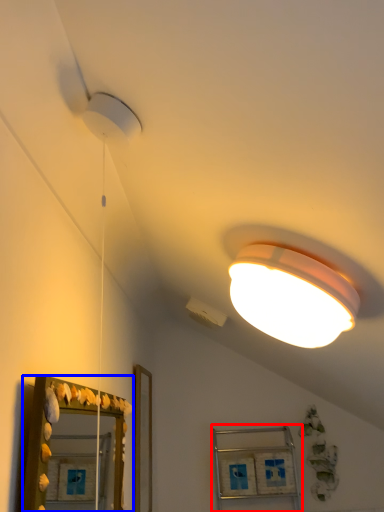
Question: Which object appears closest to the camera in this image, cabinet (highlighted by a red box) or mirror (highlighted by a blue box)?

Choices:
 (A) cabinet
 (B) mirror

Answer: (B)